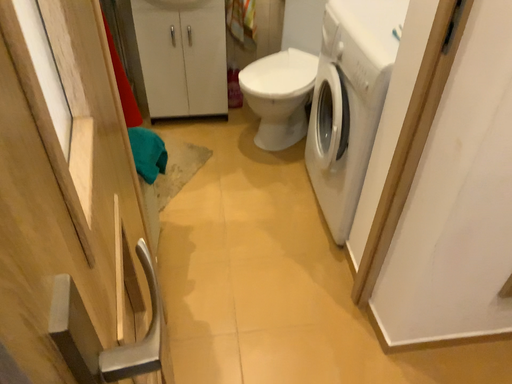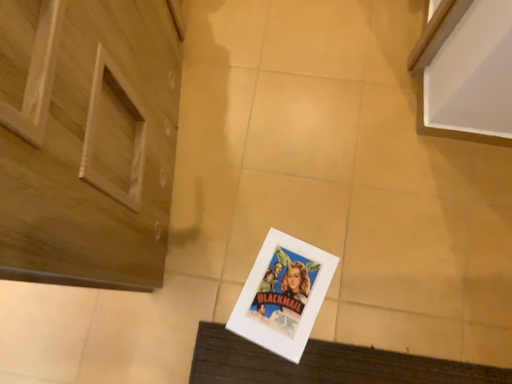
Question: How did the camera likely rotate when shooting the video?

Choices:
 (A) rotated right
 (B) rotated left

Answer: (B)